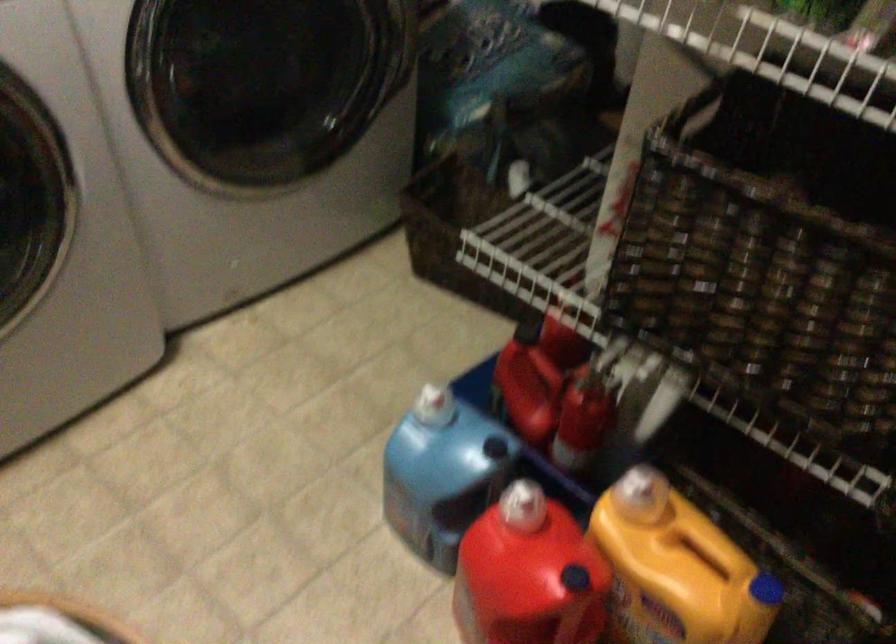
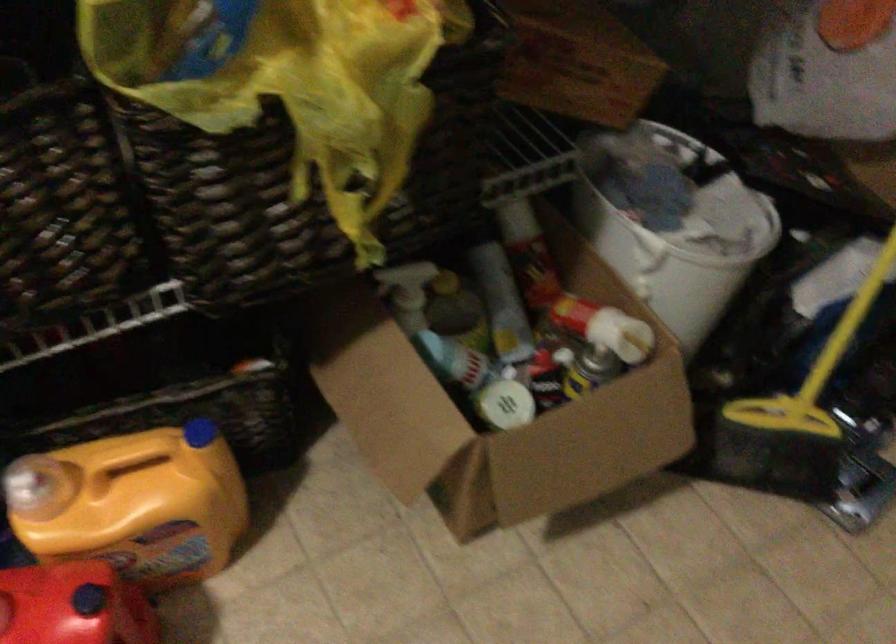
In the second image, find the point that corresponds to (669,573) in the first image.

(133, 504)